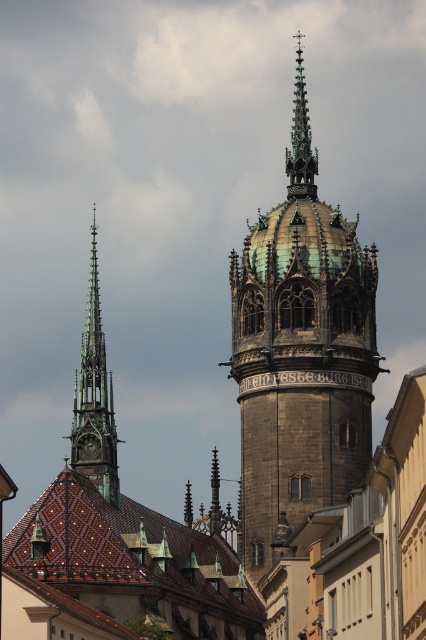
You are a tourist standing in the city square and want to take a photo of the dark brown stone tower at center. If you are currently 110 meters away from it, should you move closer or farther away to get the best possible shot?

The dark brown stone tower at center is 111.24 meters away from the viewer. Since you are currently 110 meters away, you are already very close. Moving slightly closer would bring you to the optimal distance for the best shot.

You are an architect examining the cityscape. You need to determine which structure has a higher elevation point between the dark brown stone tower at center and the green copper spire at left. Which one is taller?

The dark brown stone tower at center has a greater height compared to the green copper spire at left, so the dark brown stone tower at center is taller.

Based on the photo, you are a tourist standing in the historic European cityscape described. You notice a point marked at coordinates (301, 355). Based on the scene, what architectural feature does this point most likely represent?

The point at coordinates (301, 355) indicates the dark brown stone tower at center.